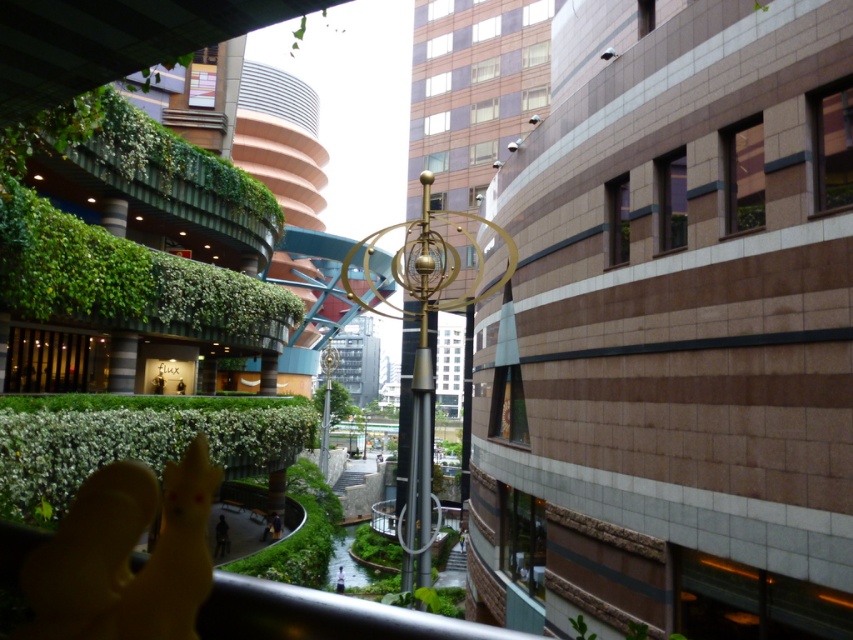
You are a delivery drone with a maximum flight distance of 10 meters. You need to deliver a package from the dark blue fabric at lower center to the light blue fabric person at center. Can you complete the delivery without exceeding your maximum flight distance?

The dark blue fabric at lower center is 8.97 meters away from the light blue fabric person at center. Since the distance is within the drone s maximum flight distance of 10 meters, the delivery can be completed successfully.

You are an observer looking at the urban scene. There is a dark blue fabric at lower center and a light blue fabric person at center. Which object is nearer to you?

The dark blue fabric at lower center is closer to the viewer than the light blue fabric person at center.